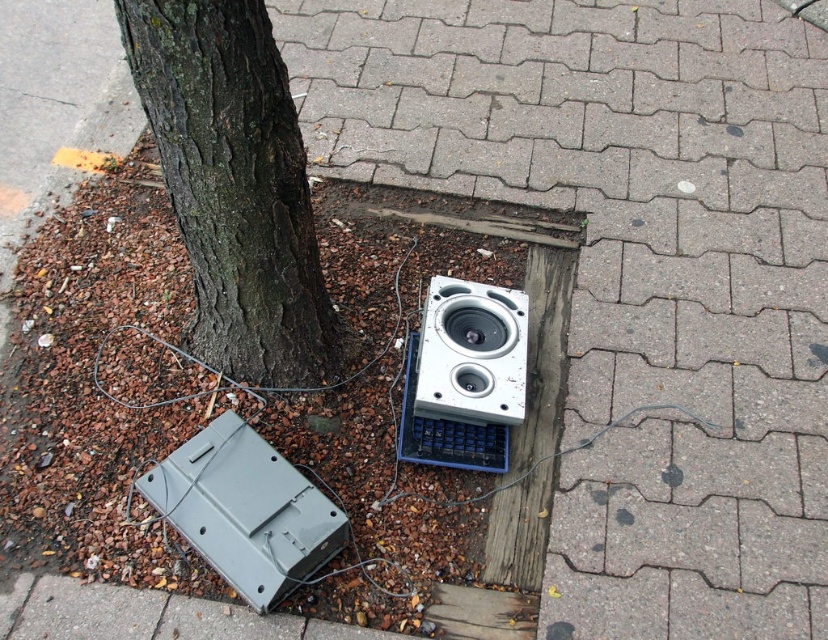
You are a delivery person trying to place a package between the dark brown bark at center and the gray matte television at lower left. Can you fit the package there if the package is 1 meter long?

The dark brown bark at center is in front of the gray matte television at lower left, so there is no space between them to place the package. The package cannot be placed there.

You are moving these electronics to a recycling center. If you need to place them side by side in a truck bed that is 1.5 meters wide, will both the gray matte television at lower left and the white plastic speaker at center fit without overlapping?

The gray matte television at lower left is wider than the white plastic speaker at center. However, since the exact widths aren

You are a delivery person who needs to place a heavy box on the ground near the dark brown bark at center and the gray matte television at lower left. Based on the scene, which object should you avoid placing the box directly on top of?

You should avoid placing the box directly on top of the dark brown bark at center because it is above the gray matte television at lower left, meaning the television is lower and the bark is higher. Since the box is heavy, placing it on the bark might not be stable, whereas the television is already lower and might be on the ground.